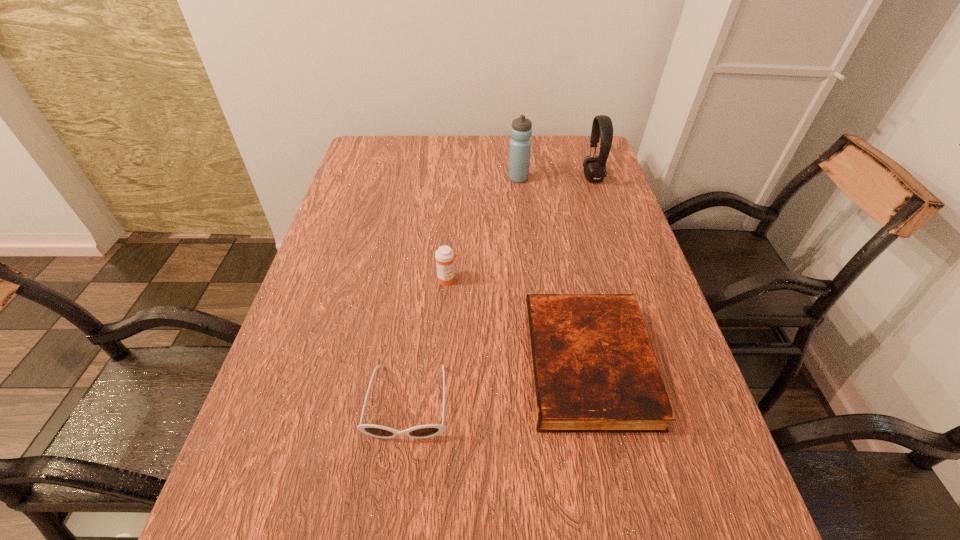
Where is `water bottle`? Image resolution: width=960 pixels, height=540 pixels. water bottle is located at coordinates (521, 130).

The height and width of the screenshot is (540, 960). I want to click on headset, so click(602, 128).

Identify the location of the third tallest object. (444, 255).

Where is `the third nearest object`? The width and height of the screenshot is (960, 540). the third nearest object is located at coordinates (444, 255).

Image resolution: width=960 pixels, height=540 pixels. What are the coordinates of `sunglasses` in the screenshot? It's located at (429, 430).

This screenshot has height=540, width=960. Identify the location of Bible. (593, 370).

Identify the location of vacant area located on the front of the water bottle. The width and height of the screenshot is (960, 540). (522, 211).

Identify the location of vacant area situated 0.060m on the front-facing side of the headset. (564, 178).

Locate an element on the screen. This screenshot has height=540, width=960. free space located on the front-facing side of the headset is located at coordinates (522, 178).

Locate an element on the screen. The height and width of the screenshot is (540, 960). vacant space situated 0.380m on the front-facing side of the headset is located at coordinates (462, 178).